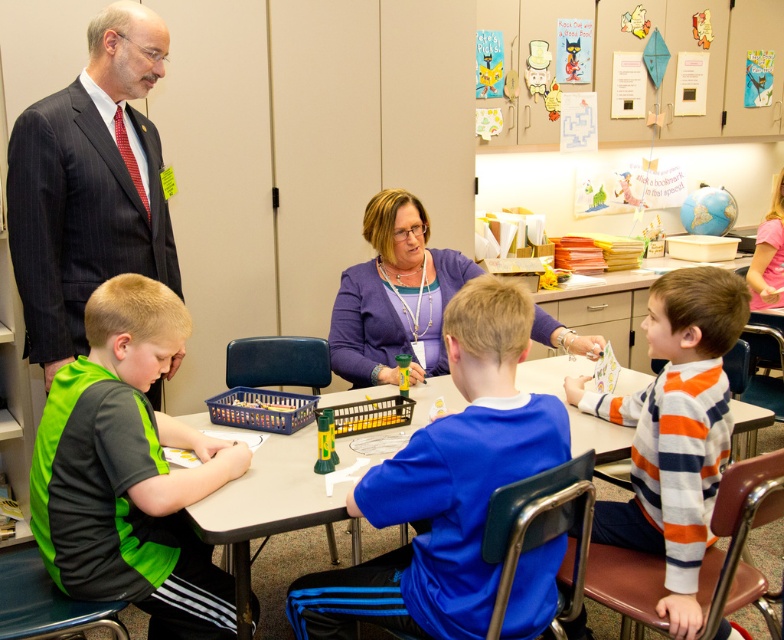
Question: Can you confirm if orange striped sweater at right is positioned above purple fabric sweater at center?

Choices:
 (A) no
 (B) yes

Answer: (A)

Question: Is green jersey at lower left positioned at the back of purple fabric sweater at center?

Choices:
 (A) no
 (B) yes

Answer: (A)

Question: Among these points, which one is farthest from the camera?

Choices:
 (A) (142, 604)
 (B) (403, 307)
 (C) (688, 406)
 (D) (307, 634)

Answer: (B)

Question: Among these objects, which one is farthest from the camera?

Choices:
 (A) blue jersey at center
 (B) green jersey at lower left
 (C) purple fabric sweater at center

Answer: (C)

Question: In this image, where is blue jersey at center located relative to purple fabric sweater at center?

Choices:
 (A) right
 (B) left

Answer: (A)

Question: Based on their relative distances, which object is nearer to the orange striped sweater at right?

Choices:
 (A) purple fabric sweater at center
 (B) smooth plastic table at center

Answer: (B)